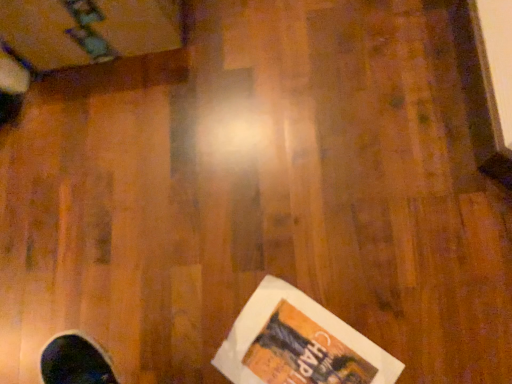
This screenshot has width=512, height=384. What are the coordinates of `free space behind white paper flyer at lower right` in the screenshot? It's located at (252, 248).